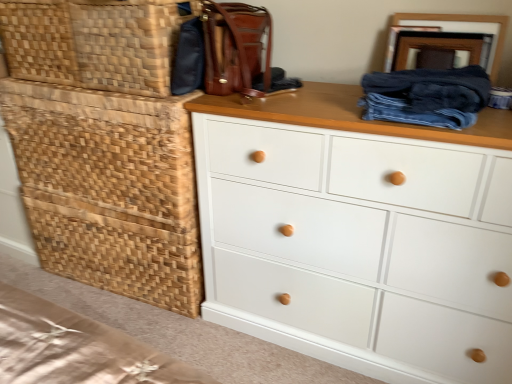
Image resolution: width=512 pixels, height=384 pixels. I want to click on vacant region above dark blue denim jeans at upper right (from a real-world perspective), so click(x=438, y=73).